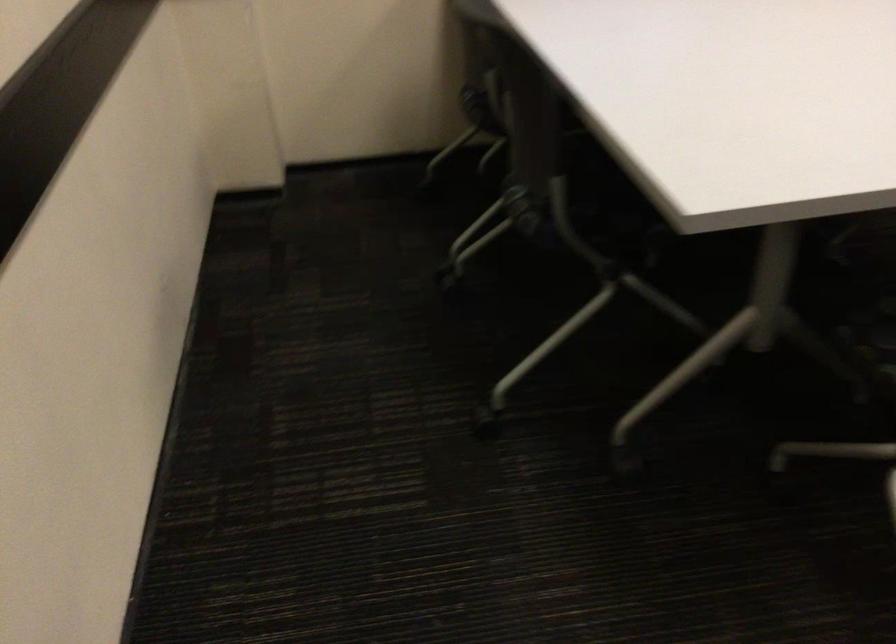
What do you see at coordinates (619, 227) in the screenshot?
I see `the chair sitting surface` at bounding box center [619, 227].